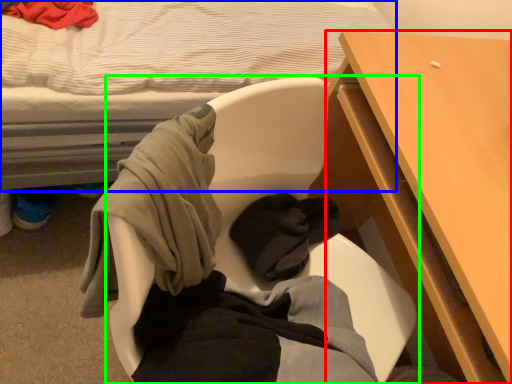
Question: Based on their relative distances, which object is farther from desk (highlighted by a red box)? Choose from bed (highlighted by a blue box) and chair (highlighted by a green box).

Choices:
 (A) bed
 (B) chair

Answer: (A)